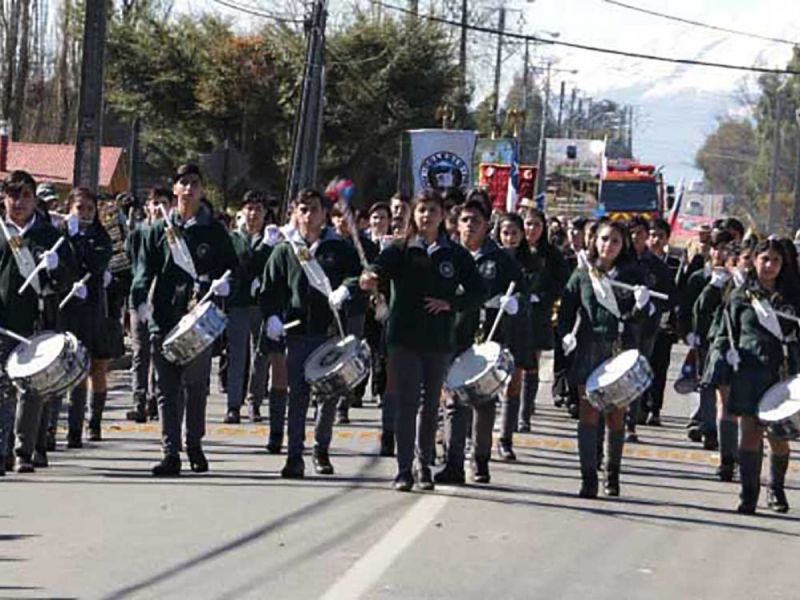
Locate an element on the screen. chest is located at coordinates (422, 271), (593, 287), (762, 304), (305, 260), (184, 247).